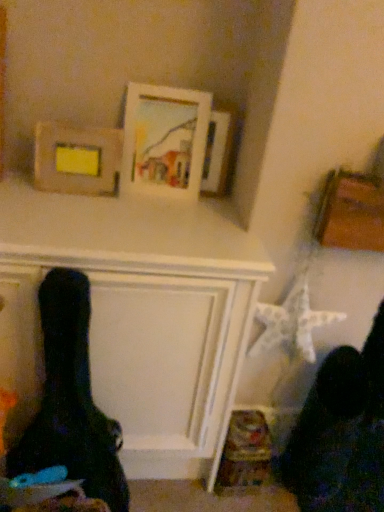
Question: Is wooden frame at upper left, which appears as the 1th picture frame when viewed from the left, next to wooden picture frame at upper center, which ranks as the 1th picture frame in right-to-left order?

Choices:
 (A) no
 (B) yes

Answer: (A)

Question: From the image's perspective, is wooden frame at upper left, which appears as the 1th picture frame when viewed from the left, over wooden picture frame at upper center, the 3th picture frame in the left-to-right sequence?

Choices:
 (A) no
 (B) yes

Answer: (A)

Question: Is wooden frame at upper left, which appears as the 3th picture frame when viewed from the right, behind wooden picture frame at upper center, the 3th picture frame in the left-to-right sequence?

Choices:
 (A) yes
 (B) no

Answer: (B)

Question: Is wooden frame at upper left, which appears as the 1th picture frame when viewed from the left, wider than wooden picture frame at upper center, which ranks as the 1th picture frame in right-to-left order?

Choices:
 (A) yes
 (B) no

Answer: (A)

Question: Can we say wooden frame at upper left, which appears as the 3th picture frame when viewed from the right, lies outside wooden picture frame at upper center, which ranks as the 1th picture frame in right-to-left order?

Choices:
 (A) no
 (B) yes

Answer: (B)

Question: Is wooden picture frame at upper center, the 3th picture frame in the left-to-right sequence, a part of wooden frame at upper left, which appears as the 1th picture frame when viewed from the left?

Choices:
 (A) yes
 (B) no

Answer: (B)

Question: Is wooden frame at upper left, which appears as the 3th picture frame when viewed from the right, aimed at white matte picture frame at upper center, positioned as the 2th picture frame in left-to-right order?

Choices:
 (A) yes
 (B) no

Answer: (B)

Question: Is wooden frame at upper left, which appears as the 1th picture frame when viewed from the left, shorter than white matte picture frame at upper center, which is the second picture frame in right-to-left order?

Choices:
 (A) no
 (B) yes

Answer: (B)

Question: Is wooden frame at upper left, which appears as the 1th picture frame when viewed from the left, further to the viewer compared to white matte picture frame at upper center, which is the second picture frame in right-to-left order?

Choices:
 (A) yes
 (B) no

Answer: (B)

Question: From a real-world perspective, is wooden frame at upper left, which appears as the 3th picture frame when viewed from the right, below white matte picture frame at upper center, which is the second picture frame in right-to-left order?

Choices:
 (A) yes
 (B) no

Answer: (A)

Question: From the image's perspective, does wooden frame at upper left, which appears as the 1th picture frame when viewed from the left, appear lower than white matte picture frame at upper center, which is the second picture frame in right-to-left order?

Choices:
 (A) no
 (B) yes

Answer: (B)

Question: Can you confirm if wooden frame at upper left, which appears as the 1th picture frame when viewed from the left, is smaller than white matte picture frame at upper center, which is the second picture frame in right-to-left order?

Choices:
 (A) no
 (B) yes

Answer: (B)

Question: Is white matte picture frame at upper center, which is the second picture frame in right-to-left order, taller than wooden frame at upper left, which appears as the 3th picture frame when viewed from the right?

Choices:
 (A) no
 (B) yes

Answer: (B)